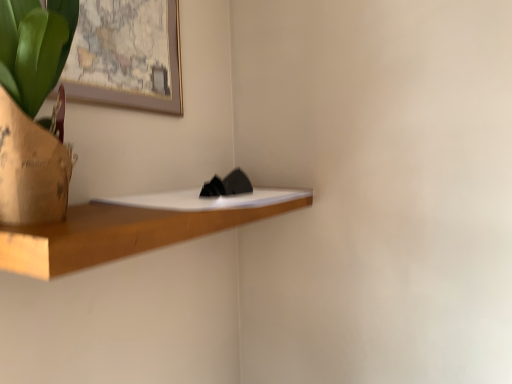
What do you see at coordinates (128, 231) in the screenshot? The height and width of the screenshot is (384, 512). I see `wooden shelf at center` at bounding box center [128, 231].

Where is `wooden shelf at center`? The height and width of the screenshot is (384, 512). wooden shelf at center is located at coordinates (128, 231).

The image size is (512, 384). I want to click on wooden framed map at upper left, so click(x=127, y=56).

Describe the element at coordinates (127, 56) in the screenshot. I see `wooden framed map at upper left` at that location.

Measure the distance between point (165, 35) and camera.

Point (165, 35) is 3.77 feet from camera.

Find the location of a particular element. This screenshot has width=512, height=384. wooden shelf at center is located at coordinates (128, 231).

Considering the positions of objects wooden framed map at upper left and wooden shelf at center in the image provided, who is more to the right, wooden framed map at upper left or wooden shelf at center?

From the viewer's perspective, wooden shelf at center appears more on the right side.

Does wooden framed map at upper left lie behind wooden shelf at center?

Yes, the depth of wooden framed map at upper left is greater than that of wooden shelf at center.

Considering the positions of points (83, 97) and (243, 214), is point (83, 97) closer to camera compared to point (243, 214)?

Yes, it is in front of point (243, 214).

From the image's perspective, is wooden framed map at upper left on wooden shelf at center?

Indeed, from the image's perspective, wooden framed map at upper left is shown above wooden shelf at center.

From a real-world perspective, which object stands above the other?

wooden framed map at upper left.

Is wooden framed map at upper left wider or thinner than wooden shelf at center?

In the image, wooden framed map at upper left appears to be more narrow than wooden shelf at center.

Which of these two, wooden framed map at upper left or wooden shelf at center, stands shorter?

Standing shorter between the two is wooden shelf at center.

Consider the image. In terms of size, does wooden framed map at upper left appear bigger or smaller than wooden shelf at center?

Clearly, wooden framed map at upper left is smaller in size than wooden shelf at center.

Is wooden framed map at upper left completely or partially outside of wooden shelf at center?

wooden framed map at upper left lies outside wooden shelf at center's area.

Are wooden framed map at upper left and wooden shelf at center making contact?

No, wooden framed map at upper left is not with wooden shelf at center.

Is wooden framed map at upper left turned away from wooden shelf at center?

That's not correct — wooden framed map at upper left is not looking away from wooden shelf at center.

Can you tell me how much wooden framed map at upper left and wooden shelf at center differ in facing direction?

The facing directions of wooden framed map at upper left and wooden shelf at center are 0.148 degrees apart.

At what (x,y) coordinates should I click in order to perform the action: click on picture frame located on the left of wooden shelf at center. Please return your answer as a coordinate pair (x, y). The height and width of the screenshot is (384, 512). Looking at the image, I should click on (127, 56).

Is wooden shelf at center at the right side of wooden framed map at upper left?

Correct, you'll find wooden shelf at center to the right of wooden framed map at upper left.

Is wooden shelf at center positioned in front of wooden framed map at upper left?

Yes.

Which point is more forward, (95,201) or (127,37)?

The point (95,201) is closer.

From the image's perspective, is wooden shelf at center below wooden framed map at upper left?

Indeed, from the image's perspective, wooden shelf at center is shown beneath wooden framed map at upper left.

From a real-world perspective, is wooden shelf at center physically located above or below wooden framed map at upper left?

In terms of real-world spatial position, wooden shelf at center is below wooden framed map at upper left.

Considering the relative sizes of wooden shelf at center and wooden framed map at upper left in the image provided, is wooden shelf at center wider than wooden framed map at upper left?

Indeed, wooden shelf at center has a greater width compared to wooden framed map at upper left.

Is wooden shelf at center taller or shorter than wooden framed map at upper left?

Clearly, wooden shelf at center is shorter compared to wooden framed map at upper left.

Considering the sizes of objects wooden shelf at center and wooden framed map at upper left in the image provided, who is bigger, wooden shelf at center or wooden framed map at upper left?

With larger size is wooden shelf at center.

Is wooden shelf at center situated inside wooden framed map at upper left or outside?

wooden shelf at center is not enclosed by wooden framed map at upper left.

Is wooden shelf at center placed right next to wooden framed map at upper left?

There is a gap between wooden shelf at center and wooden framed map at upper left.

Is wooden shelf at center oriented away from wooden framed map at upper left?

No, wooden framed map at upper left is not at the back of wooden shelf at center.

How many degrees apart are the facing directions of wooden shelf at center and wooden framed map at upper left?

The angular difference between wooden shelf at center and wooden framed map at upper left is 0.148 degrees.

How much distance is there between wooden shelf at center and wooden framed map at upper left?

They are 14.07 inches apart.

The image size is (512, 384). Find the location of `picture frame above the wooden shelf at center (from the image's perspective)`. picture frame above the wooden shelf at center (from the image's perspective) is located at coordinates (127, 56).

Locate an element on the screen. The width and height of the screenshot is (512, 384). picture frame above the wooden shelf at center (from the image's perspective) is located at coordinates (127, 56).

At what (x,y) coordinates should I click in order to perform the action: click on picture frame to the left of wooden shelf at center. Please return your answer as a coordinate pair (x, y). The image size is (512, 384). Looking at the image, I should click on (127, 56).